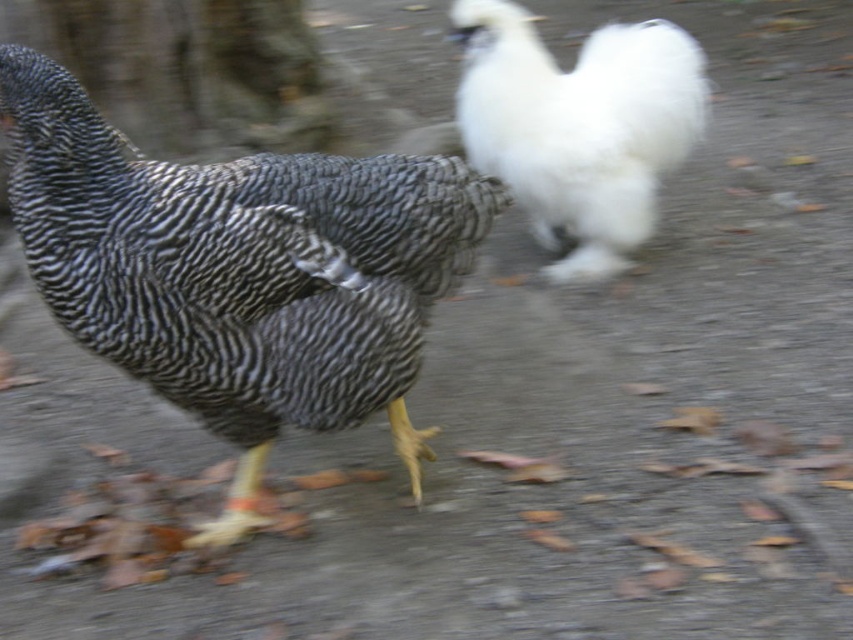
Question: Does speckled feathered chicken at left appear over white fluffy chicken at upper right?

Choices:
 (A) no
 (B) yes

Answer: (A)

Question: Does speckled feathered chicken at left appear over white fluffy chicken at upper right?

Choices:
 (A) yes
 (B) no

Answer: (B)

Question: Which point appears closest to the camera in this image?

Choices:
 (A) (350, 412)
 (B) (643, 84)

Answer: (A)

Question: Which object is farther from the camera taking this photo?

Choices:
 (A) white fluffy chicken at upper right
 (B) speckled feathered chicken at left

Answer: (A)

Question: From the image, what is the correct spatial relationship of speckled feathered chicken at left in relation to white fluffy chicken at upper right?

Choices:
 (A) left
 (B) right

Answer: (A)

Question: Which point is closer to the camera?

Choices:
 (A) (311, 212)
 (B) (672, 58)

Answer: (A)